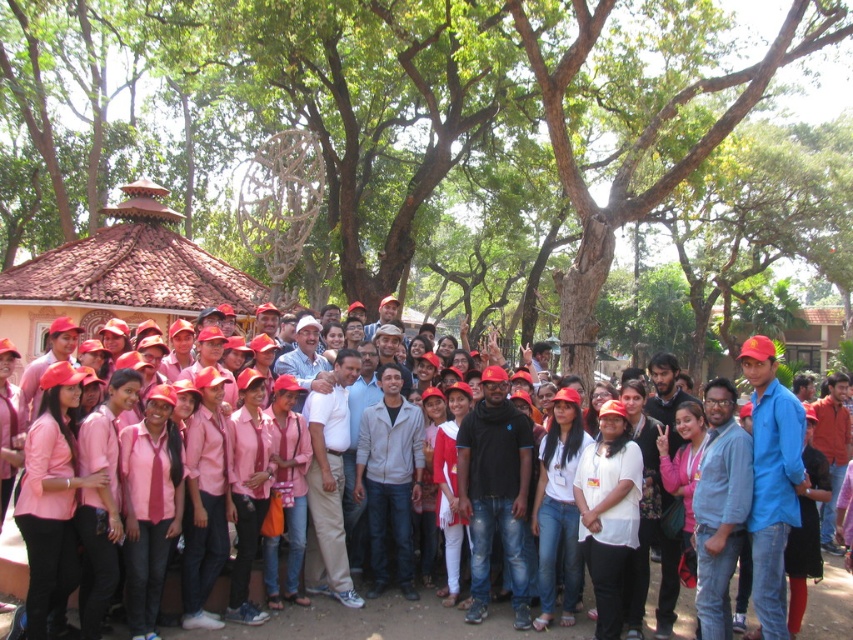
Which of these two, green leafy tree at center or pink fabric shirt at center, stands shorter?

With less height is pink fabric shirt at center.

This screenshot has width=853, height=640. Identify the location of green leafy tree at center. (364, 147).

The height and width of the screenshot is (640, 853). What are the coordinates of `green leafy tree at center` in the screenshot? It's located at (364, 147).